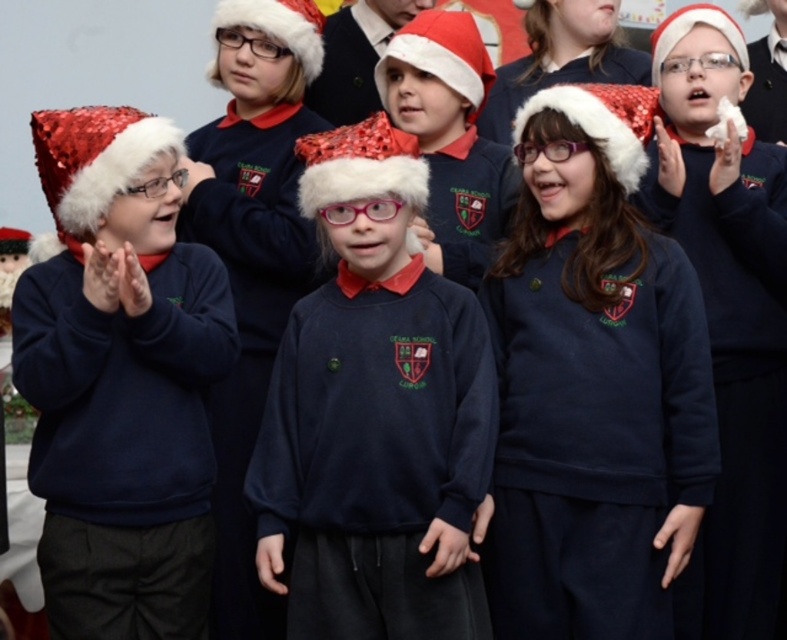
Who is positioned more to the right, navy blue sweater at center or matte black sweater at center?

From the viewer's perspective, matte black sweater at center appears more on the right side.

Does navy blue sweater at center have a lesser width compared to matte black sweater at center?

No, navy blue sweater at center is not thinner than matte black sweater at center.

Is point (394, 589) farther from viewer compared to point (767, 456)?

That is False.

Find the location of a particular element. navy blue sweater at center is located at coordinates (375, 413).

Is navy blue sweatshirt at center to the right of navy blue sweater at center from the viewer's perspective?

Indeed, navy blue sweatshirt at center is positioned on the right side of navy blue sweater at center.

What are the coordinates of `navy blue sweatshirt at center` in the screenshot? It's located at (593, 381).

Is matte black sweater at left to the left of matte black sweater at center from the viewer's perspective?

Correct, you'll find matte black sweater at left to the left of matte black sweater at center.

From the picture: Does matte black sweater at left appear over matte black sweater at center?

Actually, matte black sweater at left is below matte black sweater at center.

Where is `matte black sweater at left`? This screenshot has width=787, height=640. matte black sweater at left is located at coordinates (120, 380).